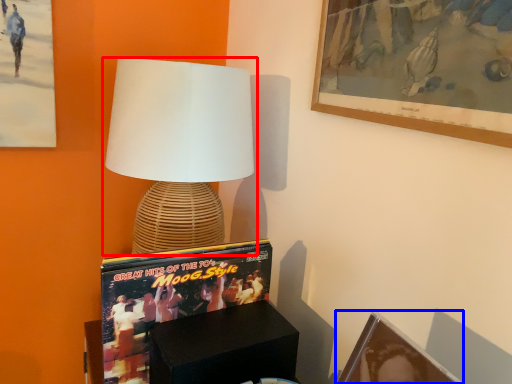
Question: Which object is closer to the camera taking this photo, lamp (highlighted by a red box) or picture frame (highlighted by a blue box)?

Choices:
 (A) lamp
 (B) picture frame

Answer: (B)